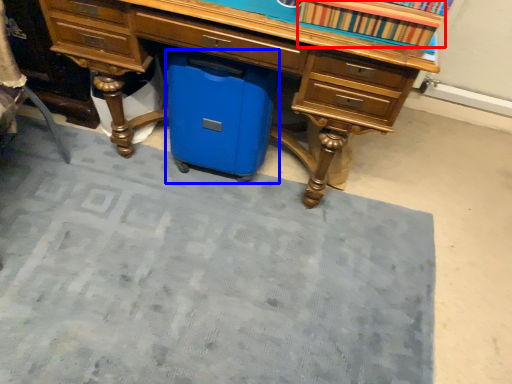
Question: Which object appears farthest to the camera in this image, book (highlighted by a red box) or cooler (highlighted by a blue box)?

Choices:
 (A) book
 (B) cooler

Answer: (B)